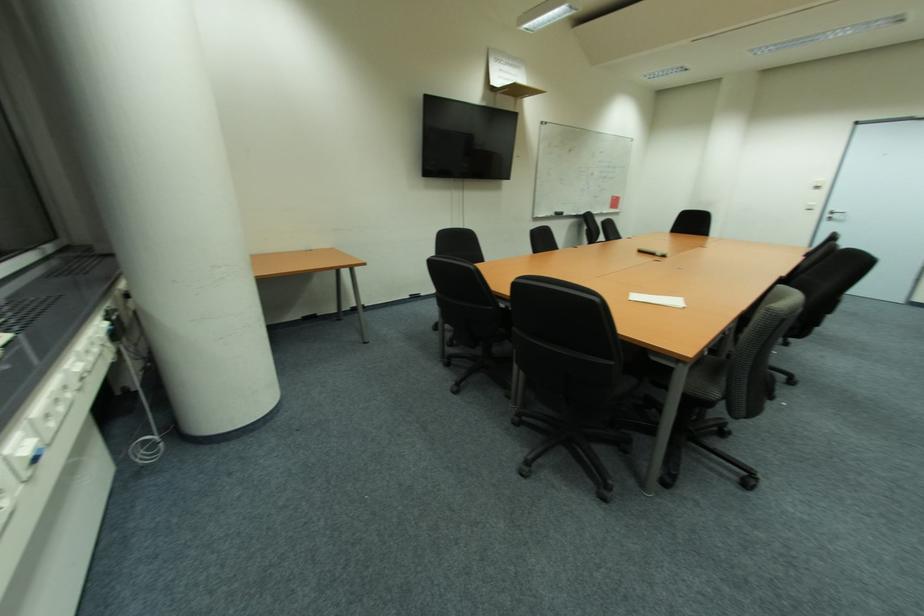
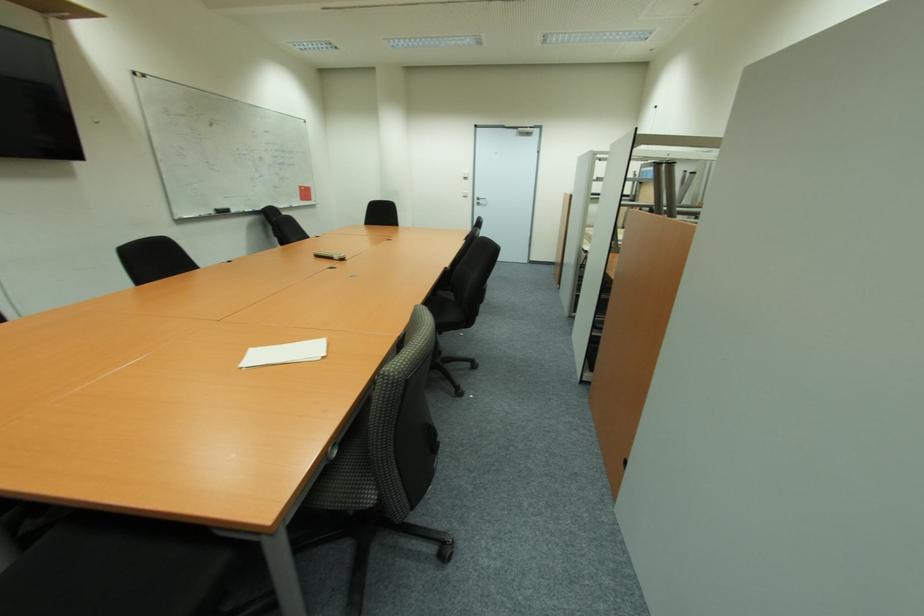
Locate, in the second image, the point that corresponds to (659,254) in the first image.

(334, 259)